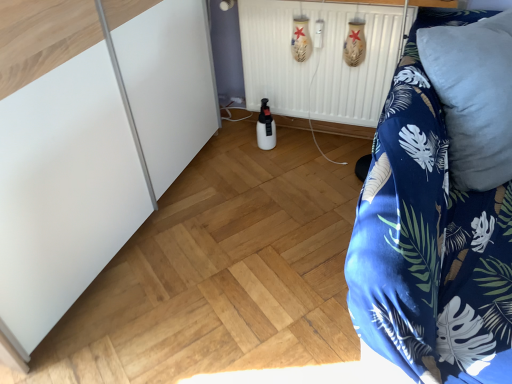
Find the location of a particular element. space that is in front of white matte bottle at center is located at coordinates (264, 163).